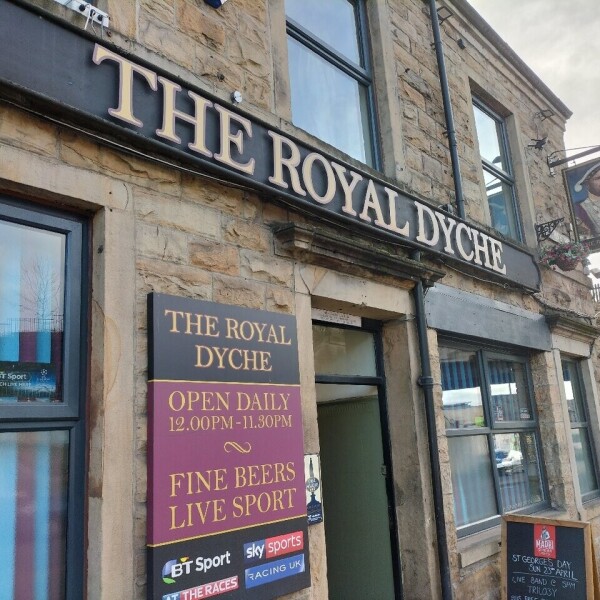
Identify the location of board. This screenshot has width=600, height=600. (212, 448).